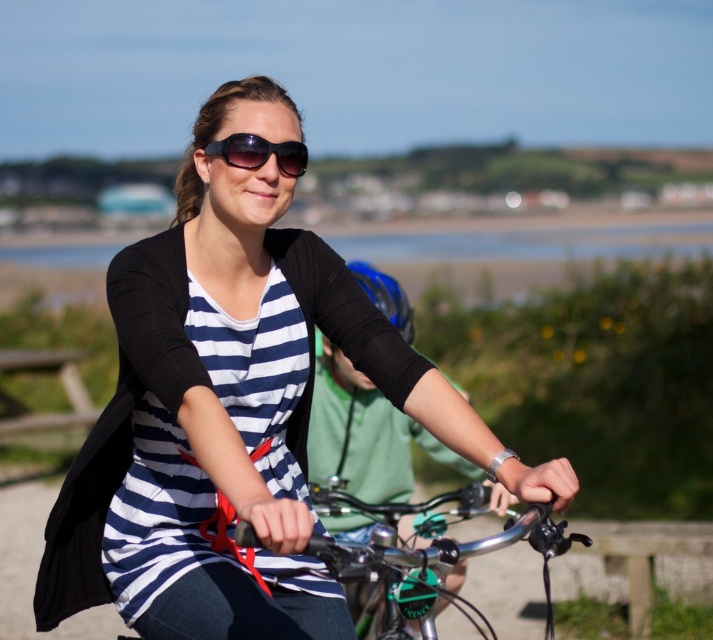
You are standing at the origin point of the image coordinate system, which is the bottom left corner. There is a metallic silver bicycle handlebars at center located at point (431,554). If you want to move towards the metallic silver bicycle handlebars at center, in which direction should you move?

To move towards the metallic silver bicycle handlebars at center located at point (431,554) from the origin, you should move northeast since the x and y coordinates are both greater than 0.5, indicating a position in the upper right quadrant of the image.

Based on the scene description, can you determine the spatial relationship between the navy striped shirt at center and the sunglasses at center?

The navy striped shirt at center is located below the sunglasses at center.